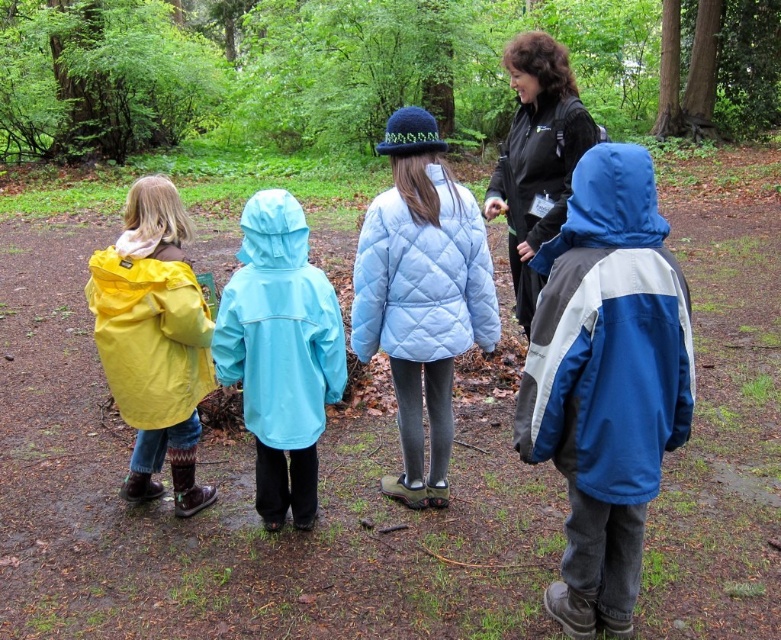
You are standing at the camera position and want to reach the point at coordinates point (x=557, y=282). If your walking speed is 3 feet per second, how many seconds will it take you to reach that point?

The distance of point (x=557, y=282) from camera is 9.10 feet. At a speed of 3 feet per second, it will take 9.10 divided by 3, which is approximately 3.03 seconds to reach the point.

You are a photographer trying to capture a photo of the light blue quilted jacket at center and the yellow waterproof jacket at left. Since you want both jackets to be clearly visible in the photo, which jacket should you focus on first to ensure the background is properly blurred?

The light blue quilted jacket at center is in front of the yellow waterproof jacket at left. To blur the background and ensure both jackets are visible, focus on the light blue quilted jacket at center first.